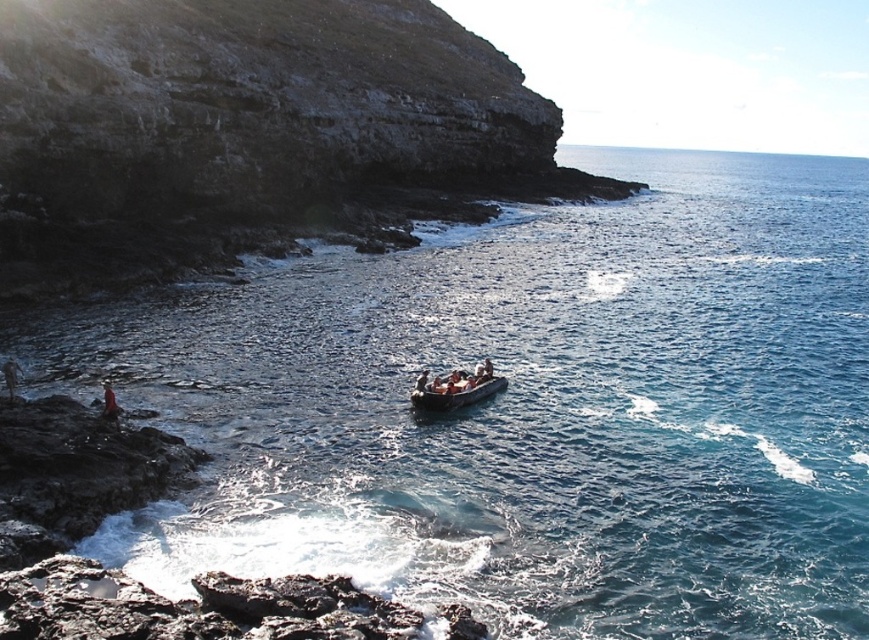
Question: In this image, where is smooth gray boat at center located relative to smooth skin person at center?

Choices:
 (A) below
 (B) above

Answer: (A)

Question: Is smooth gray boat at center bigger than smooth skin person at center?

Choices:
 (A) no
 (B) yes

Answer: (B)

Question: Which object is positioned farthest from the smooth skin person at center?

Choices:
 (A) smooth gray boat at center
 (B) red fabric person at lower left

Answer: (B)

Question: Among these points, which one is nearest to the camera?

Choices:
 (A) tap(114, 410)
 (B) tap(415, 384)

Answer: (A)

Question: Which object is closer to the camera taking this photo?

Choices:
 (A) red fabric person at lower left
 (B) smooth gray boat at center
 (C) smooth skin person at center

Answer: (A)

Question: Where is red fabric person at lower left located in relation to smooth skin person at center in the image?

Choices:
 (A) below
 (B) above

Answer: (A)